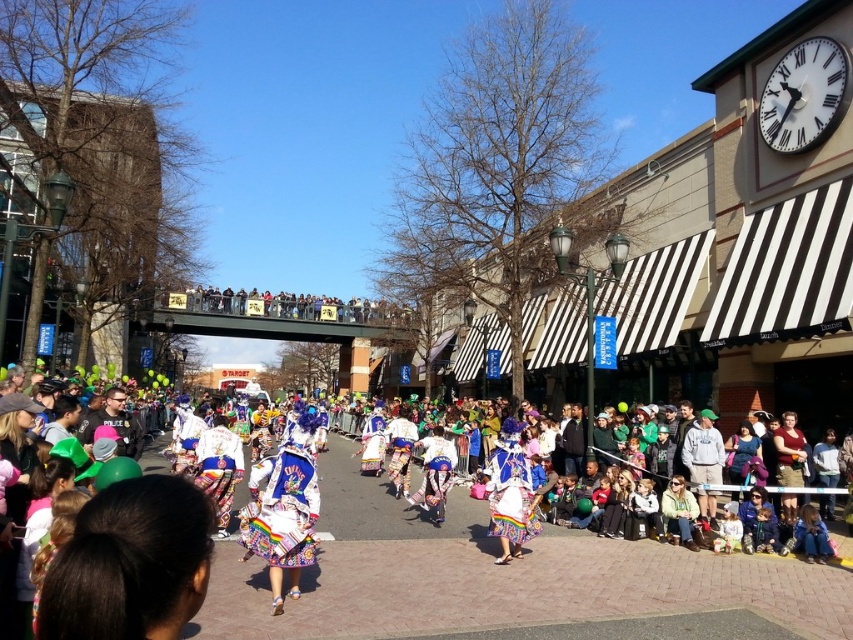
From the picture: You are a photographer positioned at the front of the parade. You want to take a photo that includes both the colorful fabric dancers at center and the white satin dress at center. Which object should you focus on first to ensure both are in the frame?

The colorful fabric dancers at center is in front of the white satin dress at center, so you should focus on the colorful fabric dancers at center first to ensure both are in the frame.

You are standing at the point marked by the coordinates point (505, 579) in the image. What are you most likely observing around you?

The point (505, 579) corresponds to colorful fabric dancers at center, so you are most likely observing the colorful fabric dancers at center around you.

In the scene shown: You are a photographer standing on the street during the parade. You want to capture a photo that includes both the white glossy clock at upper right and the colorful fabric dancer at center. Which object should you position closer to the top of your camera frame?

The white glossy clock at upper right should be positioned closer to the top of your camera frame because it is located above the colorful fabric dancer at center.